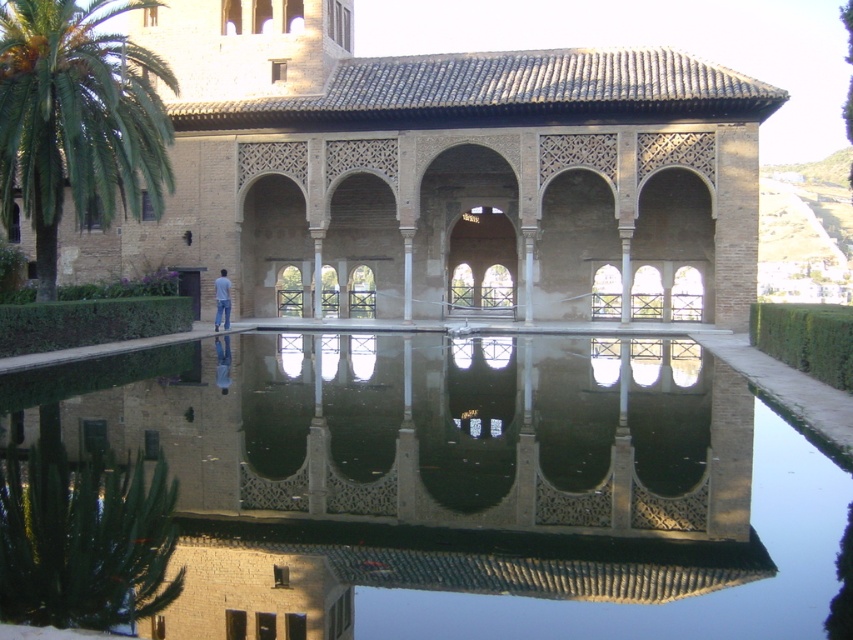
From the picture: You are an architect examining the symmetry of the scene. The clear glass water at center and the brown textured stone palace at center are both central elements. Which of these two has a narrower width?

The clear glass water at center has a lesser width compared to the brown textured stone palace at center, so it is narrower.

You are standing in front of the traditional building with a tiled roof and intricate arches. You want to take a photo of the clear glass water at center to capture its reflection of the building. Where should you position yourself to ensure the reflection is fully visible in the water?

The clear glass water at center is located at point (462,484), so you should position yourself directly in front of that point to capture the full reflection of the building in the water.

You are standing in front of the brown textured stone palace at center and the green leafy palm tree at left. Which object is located to the left of the other?

The green leafy palm tree at left is located to the left of the brown textured stone palace at center.